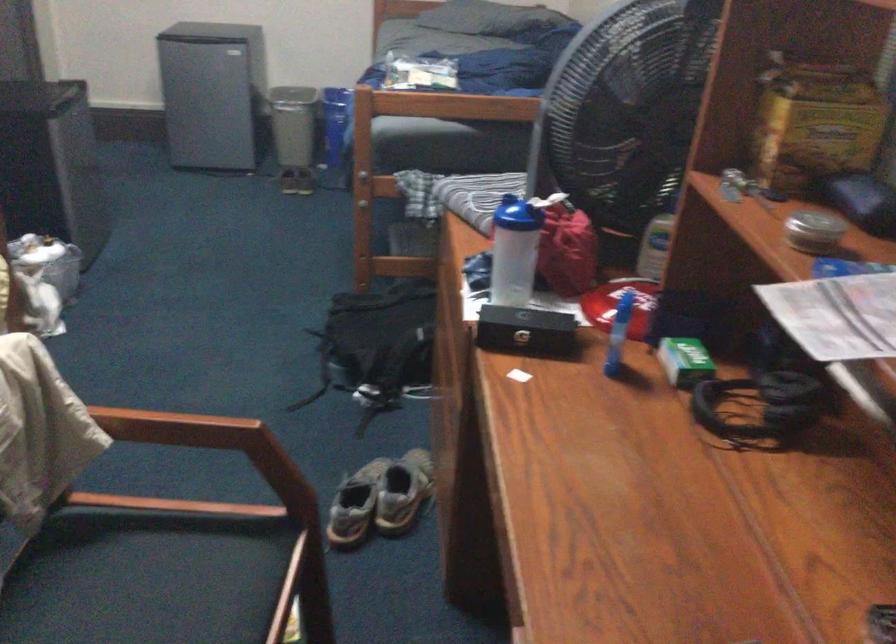
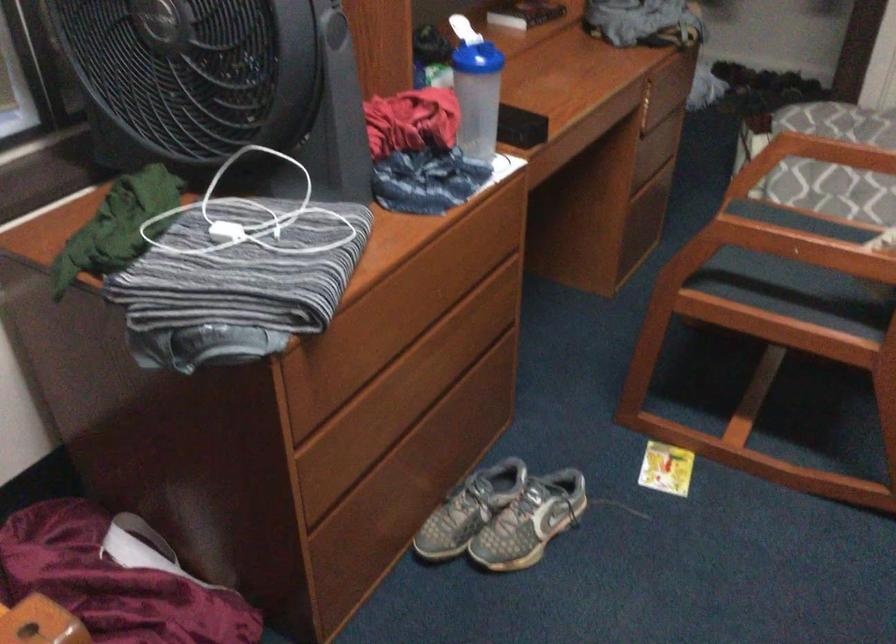
Locate, in the second image, the point that corresponds to (505,245) in the first image.

(478, 97)